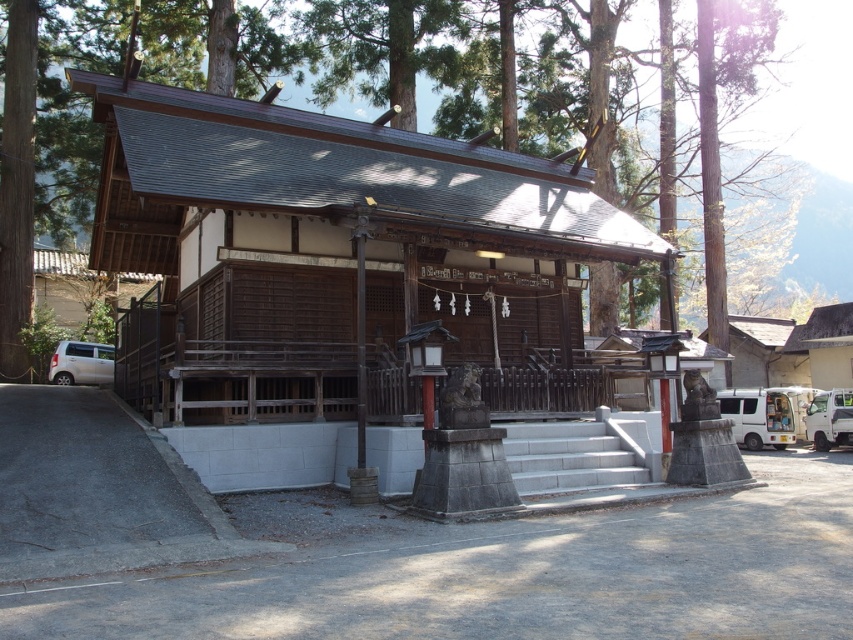
Question: Can you confirm if gray concrete stairs at center is smaller than silver metallic van at lower left?

Choices:
 (A) no
 (B) yes

Answer: (A)

Question: Which object appears closest to the camera in this image?

Choices:
 (A) white matte van at right
 (B) silver metallic van at lower left
 (C) brown wooden tree at center

Answer: (C)

Question: Can you confirm if brown wooden tree at center is positioned above silver metallic van at lower left?

Choices:
 (A) no
 (B) yes

Answer: (B)

Question: Does brown wooden tree at center have a greater width compared to white matte van at right?

Choices:
 (A) yes
 (B) no

Answer: (A)

Question: Estimate the real-world distances between objects in this image. Which object is closer to the brown wooden tree at center?

Choices:
 (A) silver metallic van at lower left
 (B) gray concrete stairs at center
 (C) white matte van at right
 (D) white matte van at lower right

Answer: (A)

Question: Which object is positioned farthest from the silver metallic van at lower left?

Choices:
 (A) white matte van at lower right
 (B) white matte van at right
 (C) gray concrete stairs at center
 (D) brown wooden tree at center

Answer: (B)